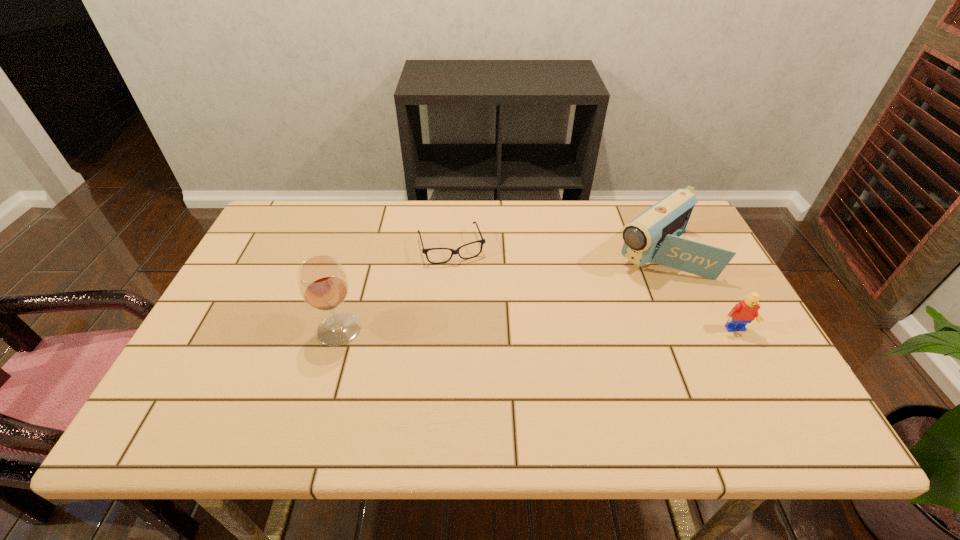
At what (x,y) coordinates should I click in order to perform the action: click on free space located on the front-facing side of the spectacles. Please return your answer as a coordinate pair (x, y). The width and height of the screenshot is (960, 540). Looking at the image, I should click on (484, 340).

What are the coordinates of `vacant space located 0.070m on the side of the second tallest object with the flip-out screen` in the screenshot? It's located at (612, 282).

You are a GUI agent. You are given a task and a screenshot of the screen. Output one action in this format:
    pyautogui.click(x=<x>, y=<y>)
    Task: Click on the free space located 0.370m on the side of the second tallest object with the flip-out screen
    This screenshot has width=960, height=540.
    Given the screenshot: What is the action you would take?
    pyautogui.click(x=538, y=341)

The width and height of the screenshot is (960, 540). What are the coordinates of `free location located on the side of the second tallest object with the flip-out screen` in the screenshot? It's located at (546, 334).

Where is `spectacles that is at the far edge`? The width and height of the screenshot is (960, 540). spectacles that is at the far edge is located at coordinates (453, 252).

Locate an element on the screen. camcorder located in the far edge section of the desktop is located at coordinates (653, 236).

Where is `Lego at the right edge`? Lego at the right edge is located at coordinates (744, 312).

You are a GUI agent. You are given a task and a screenshot of the screen. Output one action in this format:
    pyautogui.click(x=<x>, y=<y>)
    Task: Click on the camcorder at the right edge
    Image resolution: width=960 pixels, height=540 pixels.
    Given the screenshot: What is the action you would take?
    pyautogui.click(x=653, y=236)

Find the location of `object located at the far right corner`. object located at the far right corner is located at coordinates (653, 236).

The width and height of the screenshot is (960, 540). In order to click on vacant area at the far edge in this screenshot , I will do `click(449, 246)`.